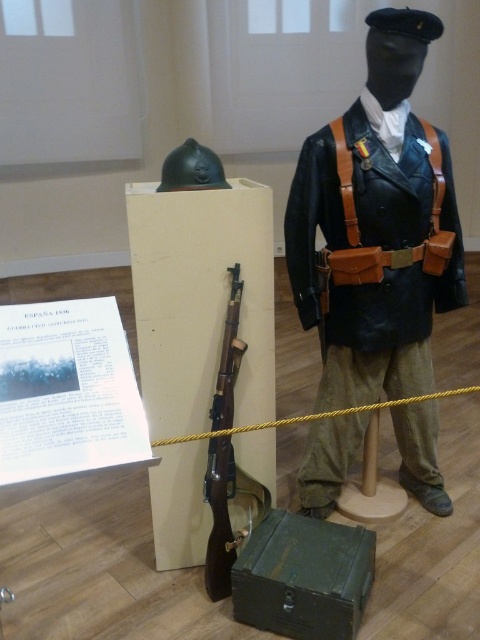
Is point (459, 237) positioned after point (228, 324)?

Yes, it is behind point (228, 324).

Which is below, leather jacket at center or wooden rifle at center?

wooden rifle at center is below.

Which is in front, point (432, 209) or point (227, 557)?

Point (227, 557)

Find the location of a particular element. This screenshot has width=480, height=640. leather jacket at center is located at coordinates (376, 227).